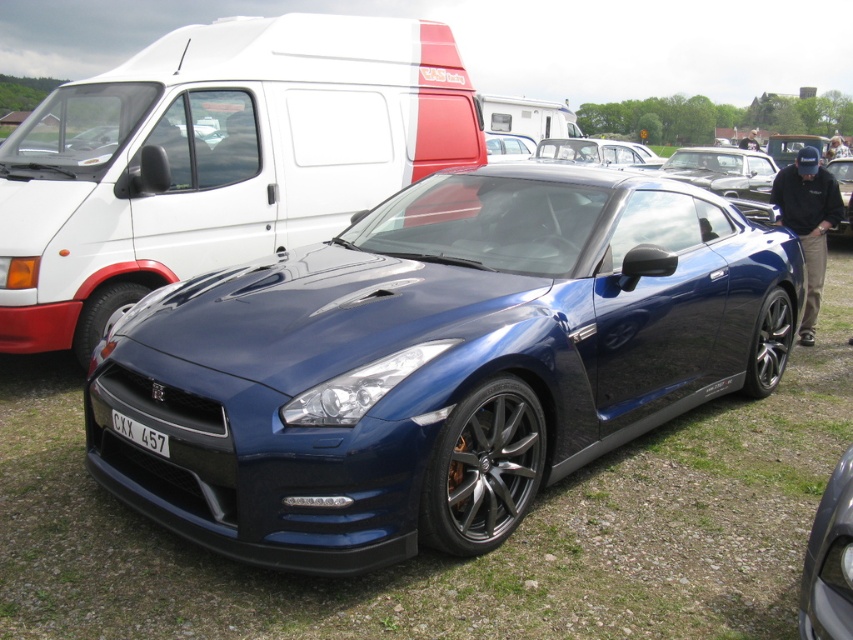
Question: Does glossy blue sports car at center have a lesser width compared to white plastic license plate at center?

Choices:
 (A) yes
 (B) no

Answer: (B)

Question: Which object appears farthest from the camera in this image?

Choices:
 (A) white matte van at upper center
 (B) glossy blue sports car at center
 (C) white plastic license plate at center
 (D) glossy blue car at center

Answer: (A)

Question: Among these objects, which one is farthest from the camera?

Choices:
 (A) white matte van at upper center
 (B) glossy blue car at center
 (C) white plastic license plate at center
 (D) glossy blue sports car at center

Answer: (A)

Question: Is white matte van at upper center further to camera compared to glossy blue car at center?

Choices:
 (A) yes
 (B) no

Answer: (A)

Question: Is glossy blue car at center in front of white plastic license plate at center?

Choices:
 (A) yes
 (B) no

Answer: (A)

Question: Which object is closer to the camera taking this photo?

Choices:
 (A) glossy blue car at center
 (B) glossy blue sports car at center
 (C) white plastic license plate at center
 (D) white matte van at upper center

Answer: (A)